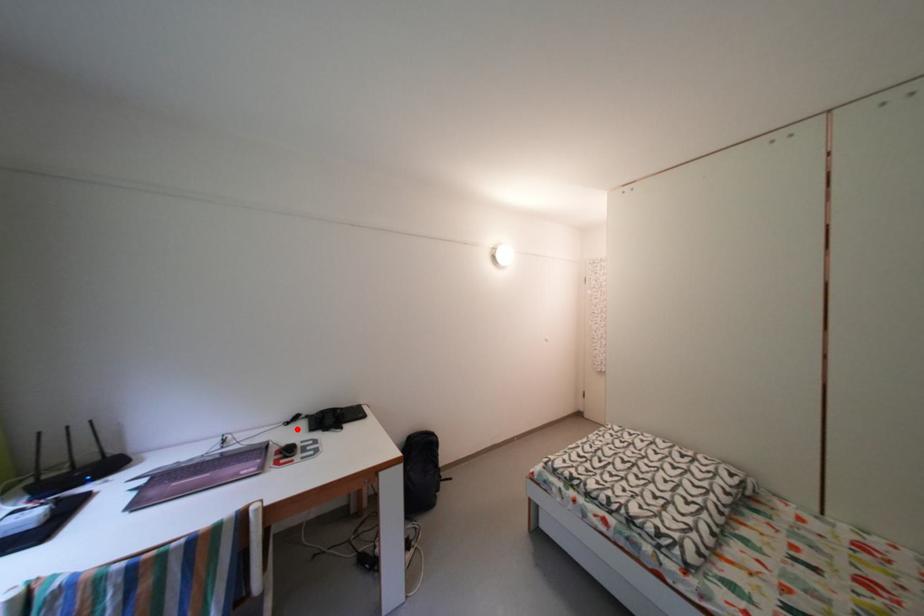
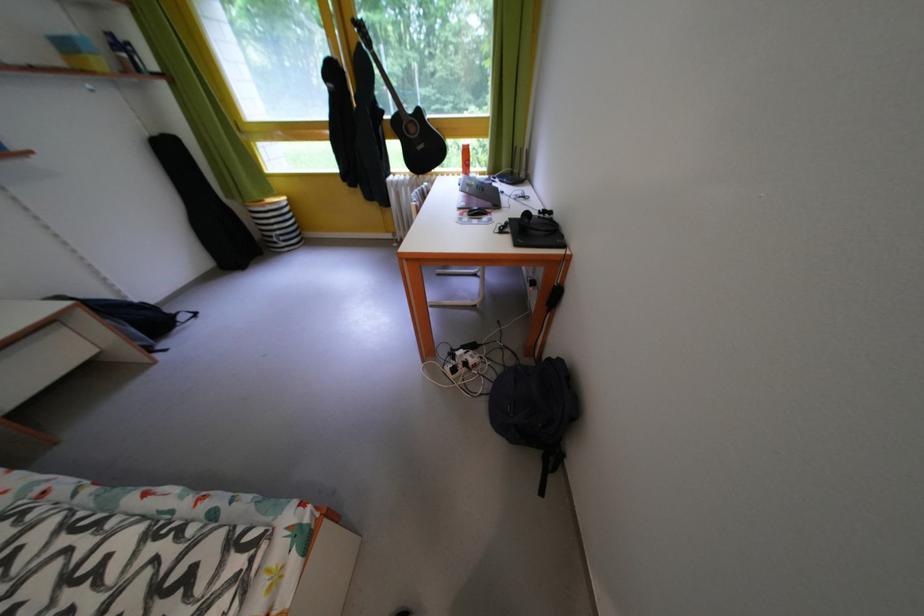
Find the pixel in the second image that matches the highlighted location in the first image.

(550, 217)